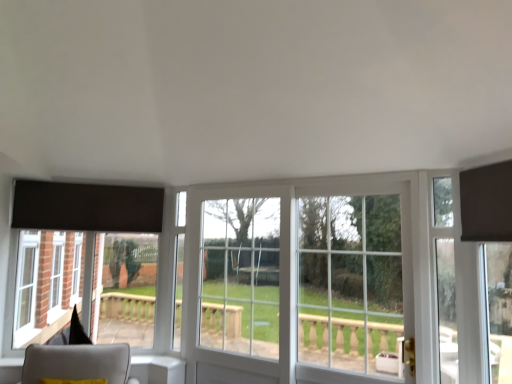
Question: Is matte black curtain at upper right to the left or to the right of clear glass window at center in the image?

Choices:
 (A) left
 (B) right

Answer: (B)

Question: Is matte black curtain at upper right wider or thinner than clear glass window at center?

Choices:
 (A) thin
 (B) wide

Answer: (A)

Question: Estimate the real-world distances between objects in this image. Which object is farther from the clear glass window at center?

Choices:
 (A) clear glass door at center
 (B) light gray fabric chair at lower left
 (C) clear glass door at right
 (D) matte black curtain at upper right

Answer: (B)

Question: Which object is the closest to the light gray fabric chair at lower left?

Choices:
 (A) clear glass window at center
 (B) clear glass door at center
 (C) matte black curtain at upper right
 (D) clear glass door at right

Answer: (B)